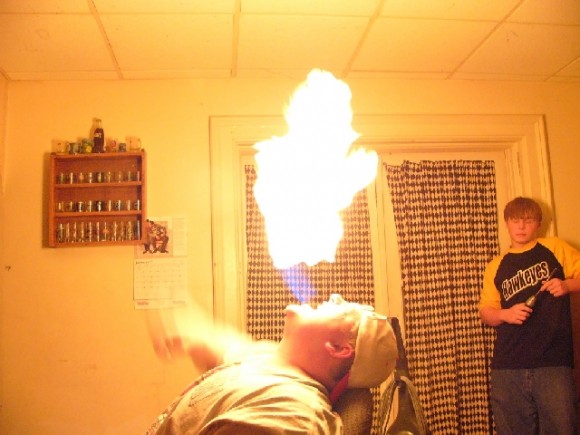
I want to click on trinket shelves, so click(97, 186).